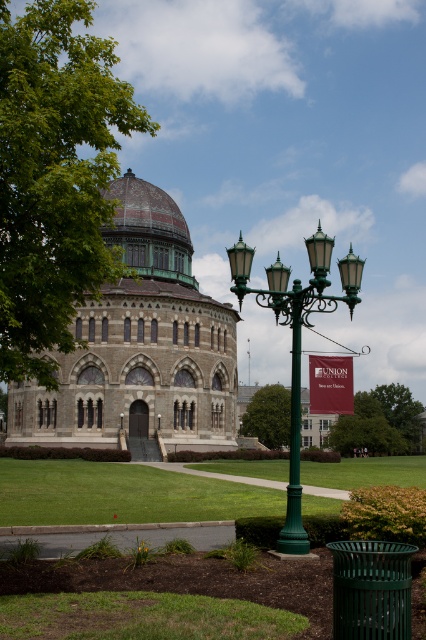
In the scene shown: You are a visitor standing in front of the historic building and see the green leafy tree at upper left and the green metal street light at center. Which object is higher in the image?

The green leafy tree at upper left is above the green metal street light at center, so it is higher in the image.

You are standing at the entrance of the historic building and want to locate the green metal street light at center. According to the coordinates provided, where would you find it?

The green metal street light at center is located at coordinates point [296,340].

You are standing at the entrance of the historic building and want to find the green leafy tree at lower center. According to the coordinates provided, where should you look relative to your current position?

The green leafy tree at lower center is located at coordinates point [379,420], which means it is positioned to the lower right and slightly forward from your current position at the entrance.